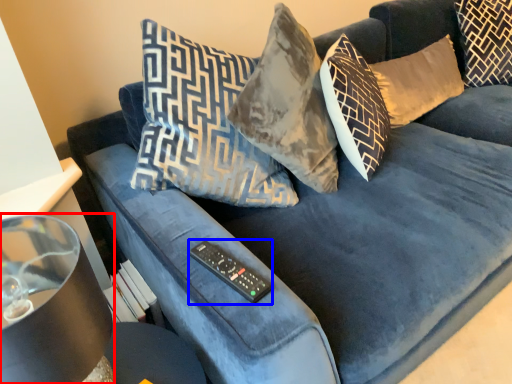
Question: Among these objects, which one is farthest to the camera, lamp (highlighted by a red box) or remote (highlighted by a blue box)?

Choices:
 (A) lamp
 (B) remote

Answer: (B)